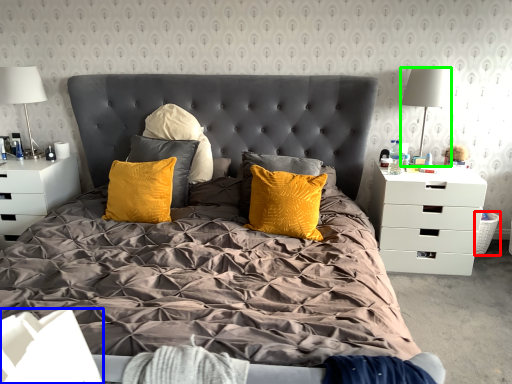
Question: Which is farther away from picnic basket (highlighted by a red box)? box (highlighted by a blue box) or lamp (highlighted by a green box)?

Choices:
 (A) box
 (B) lamp

Answer: (A)